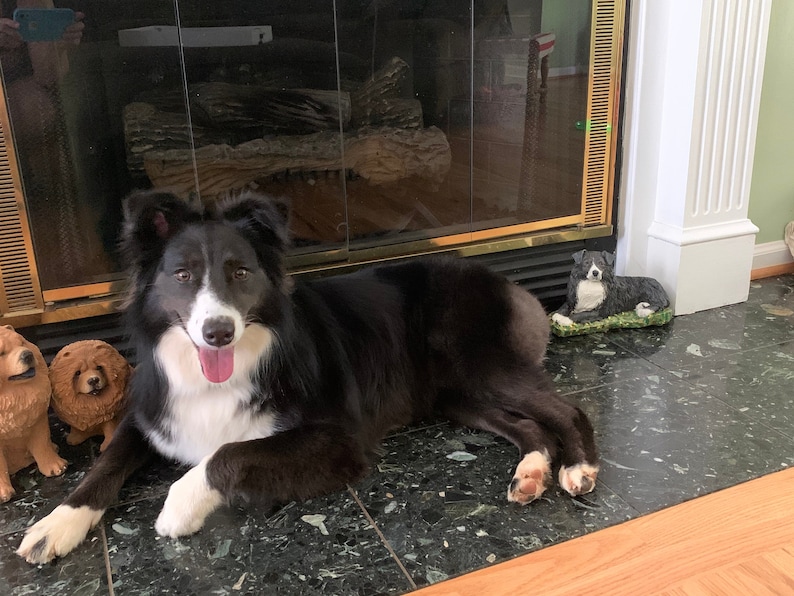
I want to click on fireplace logs, so click(x=252, y=117), click(x=376, y=153).